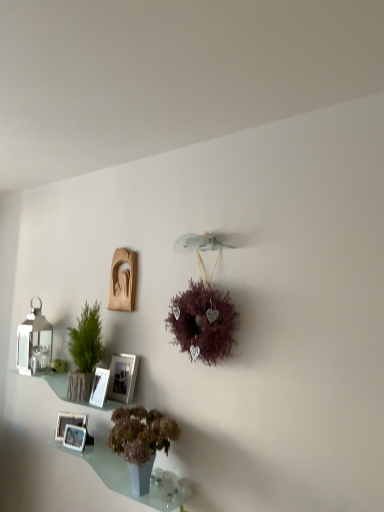
Locate an element on the screen. The height and width of the screenshot is (512, 384). translucent glass shelf at lower center, which is the 1th window sill in bottom-to-top order is located at coordinates (124, 476).

The width and height of the screenshot is (384, 512). What do you see at coordinates (123, 281) in the screenshot? I see `matte beige statue at upper center, marked as the first picture frame in a top-to-bottom arrangement` at bounding box center [123, 281].

What do you see at coordinates (141, 441) in the screenshot?
I see `matte brown vase at lower center, the 2th houseplant viewed from the top` at bounding box center [141, 441].

This screenshot has width=384, height=512. What do you see at coordinates (122, 377) in the screenshot?
I see `matte silver picture frame at center, the 2th picture frame from the top` at bounding box center [122, 377].

What is the approximate width of purple matte wreath at center?

It is 7.89 inches.

Image resolution: width=384 pixels, height=512 pixels. What are the coordinates of `satin silver lantern at left` in the screenshot? It's located at (34, 341).

Looking at this image, would you say matte brown vase at lower center, arranged as the second houseplant when viewed from the left, is a long distance from white glossy picture frame at lower left, which is counted as the second picture frame, starting from the bottom?

No, matte brown vase at lower center, arranged as the second houseplant when viewed from the left, is not far away from white glossy picture frame at lower left, which is counted as the second picture frame, starting from the bottom.

Which of these two, matte brown vase at lower center, the 1th houseplant in the bottom-to-top sequence, or white glossy picture frame at lower left, which is counted as the second picture frame, starting from the bottom, is bigger?

With larger size is matte brown vase at lower center, the 1th houseplant in the bottom-to-top sequence.

Is matte brown vase at lower center, the 1th houseplant in the bottom-to-top sequence, oriented away from white glossy picture frame at lower left, the 4th picture frame when ordered from top to bottom?

No, matte brown vase at lower center, the 1th houseplant in the bottom-to-top sequence, is not facing the opposite direction of white glossy picture frame at lower left, the 4th picture frame when ordered from top to bottom.

From a real-world perspective, is matte beige statue at upper center, marked as the first picture frame in a top-to-bottom arrangement, above or below purple matte wreath at center?

From a real-world perspective, matte beige statue at upper center, marked as the first picture frame in a top-to-bottom arrangement, is physically above purple matte wreath at center.

Based on their positions, is matte beige statue at upper center, placed as the 5th picture frame when sorted from bottom to top, located to the left or right of purple matte wreath at center?

In the image, matte beige statue at upper center, placed as the 5th picture frame when sorted from bottom to top, appears on the left side of purple matte wreath at center.

From the image's perspective, is matte beige statue at upper center, placed as the 5th picture frame when sorted from bottom to top, above purple matte wreath at center?

Indeed, from the image's perspective, matte beige statue at upper center, placed as the 5th picture frame when sorted from bottom to top, is shown above purple matte wreath at center.

Is point (130, 255) more distant than point (197, 339)?

Yes, it is behind point (197, 339).

Between matte beige statue at upper center, placed as the 5th picture frame when sorted from bottom to top, and matte glass shelf at lower left, which is the 2th window sill in bottom-to-top order, which one has less height?

Standing shorter between the two is matte glass shelf at lower left, which is the 2th window sill in bottom-to-top order.

From the matte glass shelf at lower left, the 1th window sill from the top, count 4th picture frame to the right and point to it. Please provide its 2D coordinates.

[(123, 281)]

Can you confirm if matte beige statue at upper center, marked as the first picture frame in a top-to-bottom arrangement, is positioned to the left of matte glass shelf at lower left, which is the 2th window sill in bottom-to-top order?

No, matte beige statue at upper center, marked as the first picture frame in a top-to-bottom arrangement, is not to the left of matte glass shelf at lower left, which is the 2th window sill in bottom-to-top order.

Is there a large distance between matte beige statue at upper center, placed as the 5th picture frame when sorted from bottom to top, and matte glass shelf at lower left, which is the 2th window sill in bottom-to-top order?

No, matte beige statue at upper center, placed as the 5th picture frame when sorted from bottom to top, is not far away from matte glass shelf at lower left, which is the 2th window sill in bottom-to-top order.

Does matte brown vase at lower center, the 1th houseplant in the bottom-to-top sequence, have a smaller size compared to white glossy picture frame at lower left, arranged as the 3th picture frame when ordered from the bottom?

No.

From the image's perspective, is matte brown vase at lower center, which is the first houseplant in front-to-back order, located above white glossy picture frame at lower left, marked as the 3th picture frame in a top-to-bottom arrangement?

Incorrect, from the image's perspective, matte brown vase at lower center, which is the first houseplant in front-to-back order, is lower than white glossy picture frame at lower left, marked as the 3th picture frame in a top-to-bottom arrangement.

From a real-world perspective, who is located higher, matte brown vase at lower center, which is the first houseplant in front-to-back order, or white glossy picture frame at lower left, arranged as the 3th picture frame when ordered from the bottom?

From a 3D spatial view, white glossy picture frame at lower left, arranged as the 3th picture frame when ordered from the bottom, is above.

From the picture: Considering the sizes of white glossy picture frame at lower left, placed as the 1th picture frame when sorted from bottom to top, and green textured vase at left, positioned as the 1th houseplant in left-to-right order, in the image, is white glossy picture frame at lower left, placed as the 1th picture frame when sorted from bottom to top, wider or thinner than green textured vase at left, positioned as the 1th houseplant in left-to-right order,?

white glossy picture frame at lower left, placed as the 1th picture frame when sorted from bottom to top, is thinner than green textured vase at left, positioned as the 1th houseplant in left-to-right order.

From the image's perspective, who appears lower, white glossy picture frame at lower left, placed as the 1th picture frame when sorted from bottom to top, or green textured vase at left, the 1th houseplant when ordered from back to front?

white glossy picture frame at lower left, placed as the 1th picture frame when sorted from bottom to top, is shown below in the image.

Where is `the 1st picture frame behind the green textured vase at left, arranged as the second houseplant when viewed from the right`? The image size is (384, 512). the 1st picture frame behind the green textured vase at left, arranged as the second houseplant when viewed from the right is located at coordinates (75, 437).

Consider the image. What's the angular difference between white glossy picture frame at lower left, the 4th picture frame when ordered from top to bottom, and white glossy picture frame at lower left, acting as the 5th picture frame starting from the top,'s facing directions?

They differ by 16.4 degrees in their facing directions.

In the scene shown: Is white glossy picture frame at lower left, acting as the 5th picture frame starting from the top, surrounded by white glossy picture frame at lower left, the 4th picture frame when ordered from top to bottom?

No, white glossy picture frame at lower left, acting as the 5th picture frame starting from the top, is not inside white glossy picture frame at lower left, the 4th picture frame when ordered from top to bottom.

Between white glossy picture frame at lower left, the 4th picture frame when ordered from top to bottom, and white glossy picture frame at lower left, placed as the 1th picture frame when sorted from bottom to top, which one has less height?

white glossy picture frame at lower left, placed as the 1th picture frame when sorted from bottom to top.

From the image's perspective, is white glossy picture frame at lower left, the 4th picture frame when ordered from top to bottom, located above or below white glossy picture frame at lower left, acting as the 5th picture frame starting from the top?

white glossy picture frame at lower left, the 4th picture frame when ordered from top to bottom, is above white glossy picture frame at lower left, acting as the 5th picture frame starting from the top.

Is matte brown vase at lower center, the 2th houseplant viewed from the top, further to camera compared to matte silver picture frame at center, the 2th picture frame from the top?

No, it is in front of matte silver picture frame at center, the 2th picture frame from the top.

Considering the points (140, 488) and (115, 397), which point is in front, point (140, 488) or point (115, 397)?

The point (140, 488) is more forward.

Is matte silver picture frame at center, the 2th picture frame from the top, located within matte brown vase at lower center, the 2th houseplant viewed from the top?

Definitely not — matte silver picture frame at center, the 2th picture frame from the top, is not inside matte brown vase at lower center, the 2th houseplant viewed from the top.

Locate an element on the screen. The width and height of the screenshot is (384, 512). the 1st picture frame to the left of the matte brown vase at lower center, the 2th houseplant viewed from the top, starting your count from the anchor is located at coordinates (x=122, y=377).

From the image's perspective, starting from the matte brown vase at lower center, which is the first houseplant in right-to-left order, which picture frame is the 1st one below? Please provide its 2D coordinates.

[(69, 422)]

I want to click on the 4th picture frame behind the purple matte wreath at center, so pos(123,281).

From the image, which object appears to be nearer to white glossy picture frame at lower left, the 4th picture frame when ordered from top to bottom, white glossy picture frame at lower left, placed as the 1th picture frame when sorted from bottom to top, or matte glass shelf at lower left, which is the 2th window sill in bottom-to-top order?

Among the two, white glossy picture frame at lower left, placed as the 1th picture frame when sorted from bottom to top, is located nearer to white glossy picture frame at lower left, the 4th picture frame when ordered from top to bottom.

When comparing their distances from translucent glass shelf at lower center, which is the 1th window sill in bottom-to-top order, does white glossy picture frame at lower left, arranged as the 3th picture frame when ordered from the bottom, or satin silver lantern at left seem further?

satin silver lantern at left is further to translucent glass shelf at lower center, which is the 1th window sill in bottom-to-top order.

Based on their spatial positions, is matte brown vase at lower center, the 2th houseplant viewed from the top, or translucent glass shelf at lower center, which is the 1th window sill in bottom-to-top order, further from white glossy picture frame at lower left, acting as the 5th picture frame starting from the top?

Among the two, matte brown vase at lower center, the 2th houseplant viewed from the top, is located further to white glossy picture frame at lower left, acting as the 5th picture frame starting from the top.

From the image, which object appears to be nearer to satin silver lantern at left, purple matte wreath at center or white glossy picture frame at lower left, which is counted as the second picture frame, starting from the bottom?

The object closer to satin silver lantern at left is white glossy picture frame at lower left, which is counted as the second picture frame, starting from the bottom.

When comparing their distances from matte silver picture frame at center, the fourth picture frame ordered from the bottom, does green textured vase at left, positioned as the first houseplant in top-to-bottom order, or white glossy picture frame at lower left, arranged as the 3th picture frame when ordered from the bottom, seem further?

green textured vase at left, positioned as the first houseplant in top-to-bottom order, lies further to matte silver picture frame at center, the fourth picture frame ordered from the bottom, than the other object.

From the image, which object appears to be farther from matte silver picture frame at center, the 2th picture frame from the top, matte beige statue at upper center, marked as the first picture frame in a top-to-bottom arrangement, or satin silver lantern at left?

satin silver lantern at left lies further to matte silver picture frame at center, the 2th picture frame from the top, than the other object.

Estimate the real-world distances between objects in this image. Which object is further from purple matte wreath at center, white glossy picture frame at lower left, the 4th picture frame when ordered from top to bottom, or matte glass shelf at lower left, which is the 2th window sill in bottom-to-top order?

white glossy picture frame at lower left, the 4th picture frame when ordered from top to bottom.

From the image, which object appears to be farther from translucent glass shelf at lower center, which is the 1th window sill in bottom-to-top order, matte silver picture frame at center, the 2th picture frame from the top, or matte brown vase at lower center, the 1th houseplant in the bottom-to-top sequence?

matte silver picture frame at center, the 2th picture frame from the top, is positioned further to the anchor translucent glass shelf at lower center, which is the 1th window sill in bottom-to-top order.

The height and width of the screenshot is (512, 384). I want to click on houseplant located between matte brown vase at lower center, arranged as the second houseplant when viewed from the left, and satin silver lantern at left in the depth direction, so click(85, 353).

This screenshot has height=512, width=384. Find the location of `houseplant between green textured vase at left, positioned as the 1th houseplant in left-to-right order, and translucent glass shelf at lower center, which is the 1th window sill in bottom-to-top order, in the vertical direction`. houseplant between green textured vase at left, positioned as the 1th houseplant in left-to-right order, and translucent glass shelf at lower center, which is the 1th window sill in bottom-to-top order, in the vertical direction is located at coordinates (141, 441).

The height and width of the screenshot is (512, 384). What are the coordinates of `houseplant between matte brown vase at lower center, which ranks as the second houseplant in back-to-front order, and white glossy picture frame at lower left, acting as the 5th picture frame starting from the top, along the z-axis` in the screenshot? It's located at (85, 353).

You are a GUI agent. You are given a task and a screenshot of the screen. Output one action in this format:
    pyautogui.click(x=<x>, y=<y>)
    Task: Click on the houseplant between purple matte wreath at center and matte brown vase at lower center, which is the first houseplant in front-to-back order, in the vertical direction
    Image resolution: width=384 pixels, height=512 pixels.
    Given the screenshot: What is the action you would take?
    pyautogui.click(x=85, y=353)